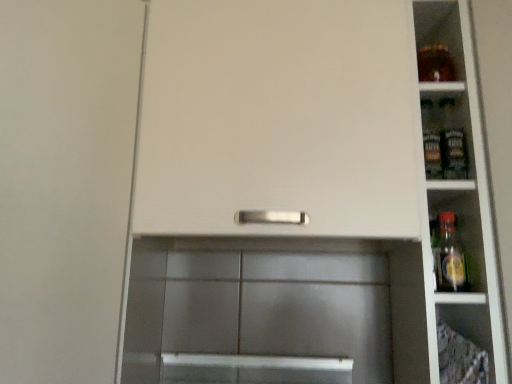
Locate an element on the screen. white glossy shelves at right is located at coordinates (463, 178).

What do you see at coordinates (463, 178) in the screenshot? I see `white glossy shelves at right` at bounding box center [463, 178].

I want to click on white matte cabinet door at center, so click(65, 183).

Describe the element at coordinates (65, 183) in the screenshot. The width and height of the screenshot is (512, 384). I see `white matte cabinet door at center` at that location.

What is the approximate height of white matte cabinet door at center?

It is 94.76 centimeters.

Find the location of a particular element. The height and width of the screenshot is (384, 512). white glossy shelves at right is located at coordinates (463, 178).

Based on their positions, is white glossy shelves at right located to the left or right of white matte cabinet door at center?

Clearly, white glossy shelves at right is on the right of white matte cabinet door at center in the image.

In the image, is white glossy shelves at right positioned in front of or behind white matte cabinet door at center?

Visually, white glossy shelves at right is located behind white matte cabinet door at center.

Which is nearer, (x=489, y=189) or (x=90, y=345)?

Point (x=489, y=189) appears to be farther away from the viewer than point (x=90, y=345).

From the image's perspective, which is below, white glossy shelves at right or white matte cabinet door at center?

white matte cabinet door at center is shown below in the image.

From a real-world perspective, is white glossy shelves at right on top of white matte cabinet door at center?

Correct, in the physical world, white glossy shelves at right is higher than white matte cabinet door at center.

Which object is wider, white glossy shelves at right or white matte cabinet door at center?

white matte cabinet door at center.

Is white glossy shelves at right taller or shorter than white matte cabinet door at center?

white glossy shelves at right is shorter than white matte cabinet door at center.

Is white glossy shelves at right bigger or smaller than white matte cabinet door at center?

In the image, white glossy shelves at right appears to be smaller than white matte cabinet door at center.

Is white glossy shelves at right situated inside white matte cabinet door at center or outside?

white glossy shelves at right lies outside white matte cabinet door at center.

Is white glossy shelves at right positioned far away from white matte cabinet door at center?

No, there isn't a large distance between white glossy shelves at right and white matte cabinet door at center.

Is white glossy shelves at right facing away from white matte cabinet door at center?

No, white matte cabinet door at center is not at the back of white glossy shelves at right.

How different are the orientations of white glossy shelves at right and white matte cabinet door at center in degrees?

white glossy shelves at right and white matte cabinet door at center are facing 91.3 degrees away from each other.

Find the location of a particular element. The image size is (512, 384). shelf that is above the white matte cabinet door at center (from a real-world perspective) is located at coordinates (463, 178).

Can you confirm if white matte cabinet door at center is positioned to the right of white glossy shelves at right?

No, white matte cabinet door at center is not to the right of white glossy shelves at right.

Considering the positions of objects white matte cabinet door at center and white glossy shelves at right in the image provided, who is behind, white matte cabinet door at center or white glossy shelves at right?

white glossy shelves at right is further from the camera.

Is point (17, 240) farther from viewer compared to point (480, 141)?

That is False.

From the image's perspective, which is below, white matte cabinet door at center or white glossy shelves at right?

white matte cabinet door at center.

From a real-world perspective, is white matte cabinet door at center above or below white glossy shelves at right?

From a real-world perspective, white matte cabinet door at center is physically below white glossy shelves at right.

Is white matte cabinet door at center thinner than white glossy shelves at right?

Incorrect, the width of white matte cabinet door at center is not less than that of white glossy shelves at right.

Considering the sizes of white matte cabinet door at center and white glossy shelves at right in the image, is white matte cabinet door at center taller or shorter than white glossy shelves at right?

white matte cabinet door at center is taller than white glossy shelves at right.

Looking at the image, does white matte cabinet door at center seem bigger or smaller compared to white glossy shelves at right?

Clearly, white matte cabinet door at center is larger in size than white glossy shelves at right.

Which is correct: white matte cabinet door at center is inside white glossy shelves at right, or outside of it?

The correct answer is: outside.

Is white matte cabinet door at center far away from white glossy shelves at right?

Actually, white matte cabinet door at center and white glossy shelves at right are a little close together.

Could you tell me if white matte cabinet door at center is facing white glossy shelves at right?

No, white matte cabinet door at center is not facing towards white glossy shelves at right.

How different are the orientations of white matte cabinet door at center and white glossy shelves at right in degrees?

The facing directions of white matte cabinet door at center and white glossy shelves at right are 91.3 degrees apart.

Find the location of a particular element. The height and width of the screenshot is (384, 512). door that is in front of the white glossy shelves at right is located at coordinates (65, 183).

Locate an element on the screen. door located below the white glossy shelves at right (from the image's perspective) is located at coordinates (65, 183).

Where is `shelf above the white matte cabinet door at center (from the image's perspective)`? The image size is (512, 384). shelf above the white matte cabinet door at center (from the image's perspective) is located at coordinates (463, 178).